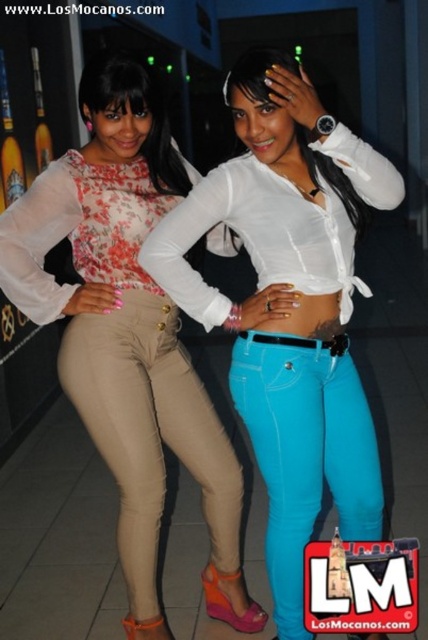
You are a photographer trying to capture the two women in the image. You notice the white glossy shirt at center and the matte floral blouse at center. Which clothing item is positioned higher on the body?

The white glossy shirt at center is positioned higher on the body than the matte floral blouse at center because it is described as being above it.